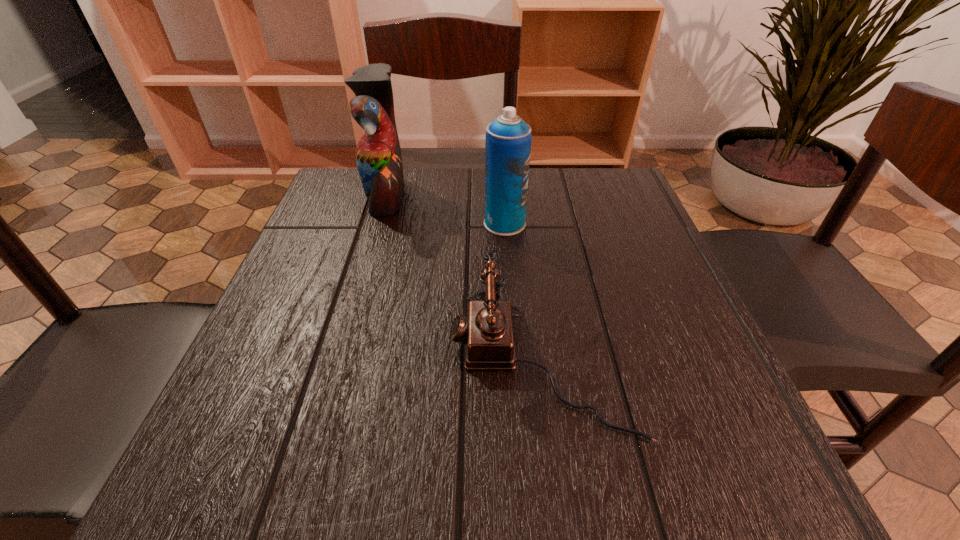
Identify the location of vacant area that lies between the shortest object and the aerosol can. The width and height of the screenshot is (960, 540). (521, 292).

Identify the location of unoccupied area between the aerosol can and the nearest object. (521, 292).

At what (x,y) coordinates should I click in order to perform the action: click on the second closest object to the parrot. Please return your answer as a coordinate pair (x, y). Looking at the image, I should click on (487, 332).

Identify which object is the nearest to the telephone. Please provide its 2D coordinates. Your answer should be formatted as a tuple, i.e. [(x, y)], where the tuple contains the x and y coordinates of a point satisfying the conditions above.

[(508, 140)]

This screenshot has width=960, height=540. I want to click on blank space that satisfies the following two spatial constraints: 1. on the back side of the aerosol can; 2. at the face of the leftmost object, so click(503, 195).

You are a GUI agent. You are given a task and a screenshot of the screen. Output one action in this format:
    pyautogui.click(x=<x>, y=<y>)
    Task: Click on the vacant area that satisfies the following two spatial constraints: 1. at the face of the leftmost object; 2. on the left side of the aerosol can
    Image resolution: width=960 pixels, height=540 pixels.
    Given the screenshot: What is the action you would take?
    378,224

The height and width of the screenshot is (540, 960). Identify the location of free location that satisfies the following two spatial constraints: 1. at the face of the parrot; 2. on the left side of the aerosol can. (378, 224).

Find the location of a particular element. This screenshot has height=540, width=960. free spot that satisfies the following two spatial constraints: 1. at the face of the parrot; 2. on the back side of the aerosol can is located at coordinates (378, 224).

Where is `vacant space that satisfies the following two spatial constraints: 1. at the face of the aerosol can; 2. on the left side of the leftmost object`? This screenshot has height=540, width=960. vacant space that satisfies the following two spatial constraints: 1. at the face of the aerosol can; 2. on the left side of the leftmost object is located at coordinates (378, 224).

The width and height of the screenshot is (960, 540). In order to click on vacant space that satisfies the following two spatial constraints: 1. on the back side of the aerosol can; 2. at the face of the leftmost object in this screenshot , I will do `click(503, 195)`.